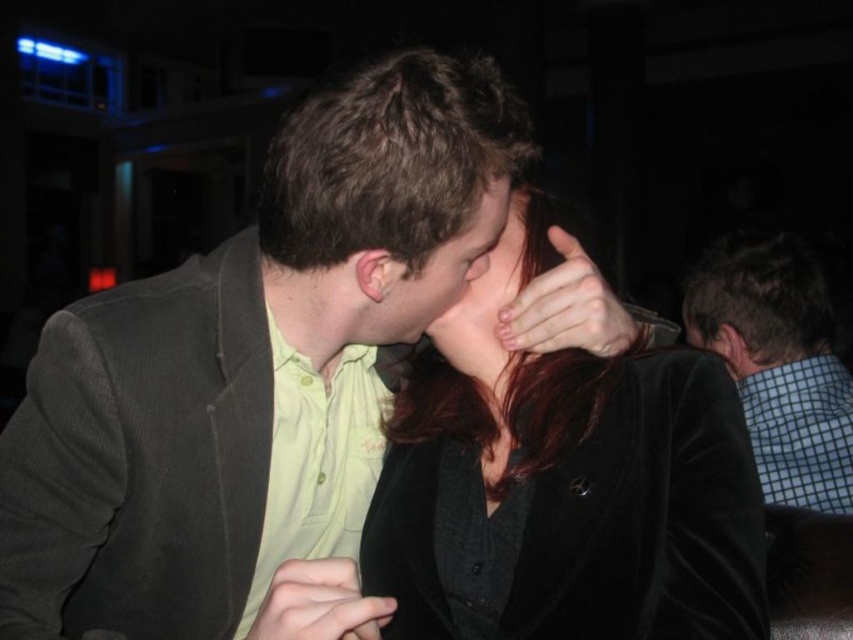
Where is `matte gray suit at center`? matte gray suit at center is located at coordinates (250, 368).

Does matte gray suit at center have a larger size compared to matte black hair at center?

Correct, matte gray suit at center is larger in size than matte black hair at center.

Does point (239, 369) come closer to viewer compared to point (474, 204)?

No, it is behind (474, 204).

You are a GUI agent. You are given a task and a screenshot of the screen. Output one action in this format:
    pyautogui.click(x=<x>, y=<y>)
    Task: Click on the matte gray suit at center
    The height and width of the screenshot is (640, 853).
    Given the screenshot: What is the action you would take?
    pyautogui.click(x=250, y=368)

Based on the photo, is blue checkered shirt at right taller than matte skin nose at center?

Yes, blue checkered shirt at right is taller than matte skin nose at center.

Does point (785, 308) come farther from viewer compared to point (465, 268)?

Yes, it is.

This screenshot has height=640, width=853. In order to click on blue checkered shirt at right in this screenshot , I will do `click(778, 364)`.

In the scene shown: Does blue checkered shirt at right appear on the left side of matte black hair at center?

No, blue checkered shirt at right is not to the left of matte black hair at center.

Can you confirm if blue checkered shirt at right is bigger than matte black hair at center?

Indeed, blue checkered shirt at right has a larger size compared to matte black hair at center.

This screenshot has width=853, height=640. What do you see at coordinates (778, 364) in the screenshot?
I see `blue checkered shirt at right` at bounding box center [778, 364].

Locate an element on the screen. The height and width of the screenshot is (640, 853). blue checkered shirt at right is located at coordinates (778, 364).